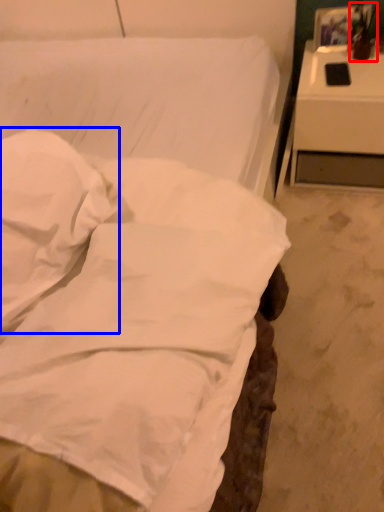
Question: Among these objects, which one is nearest to the camera, table lamp (highlighted by a red box) or pillow (highlighted by a blue box)?

Choices:
 (A) table lamp
 (B) pillow

Answer: (B)